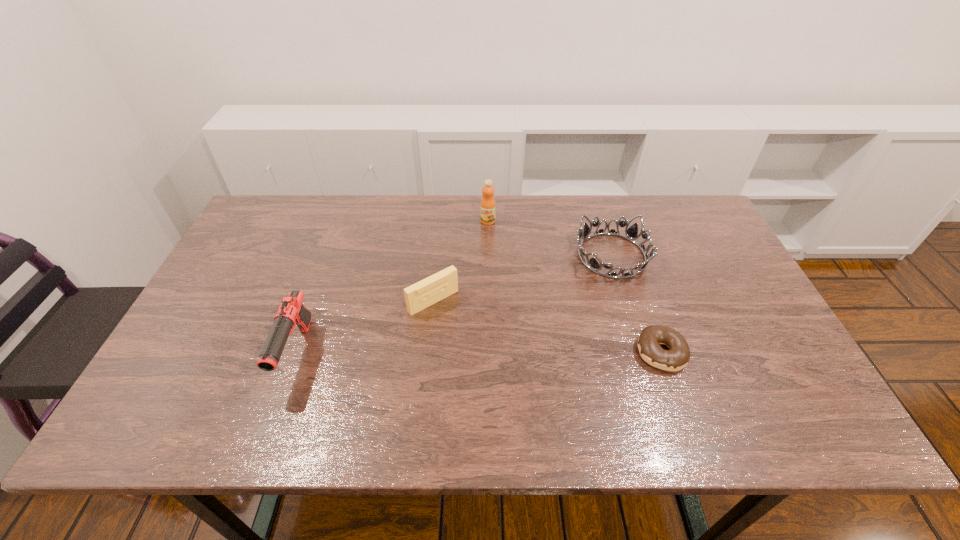
Identify the location of vacant space located on the front label of the orange juice. This screenshot has height=540, width=960. (459, 291).

Where is `vacant space located on the front-facing side of the second farthest object`? vacant space located on the front-facing side of the second farthest object is located at coordinates (510, 341).

Where is `free region located on the front-facing side of the second farthest object`? This screenshot has height=540, width=960. free region located on the front-facing side of the second farthest object is located at coordinates (502, 348).

Identify the location of free space located on the front-facing side of the second farthest object. The image size is (960, 540). (531, 323).

Locate an element on the screen. free space located 0.170m at the front of the second object from left to right with spools is located at coordinates (486, 356).

This screenshot has width=960, height=540. I want to click on vacant region located at the front of the second object from left to right with spools, so 462,330.

At what (x,y) coordinates should I click in order to perform the action: click on vacant area located at the front of the second object from left to right with spools. Please return your answer as a coordinate pair (x, y). Looking at the image, I should click on (501, 374).

Where is `orange juice located in the far edge section of the desktop`? This screenshot has width=960, height=540. orange juice located in the far edge section of the desktop is located at coordinates (488, 205).

In order to click on tiara at the far edge in this screenshot , I will do `click(631, 233)`.

Find the location of a particular element. gun that is at the near edge is located at coordinates (291, 312).